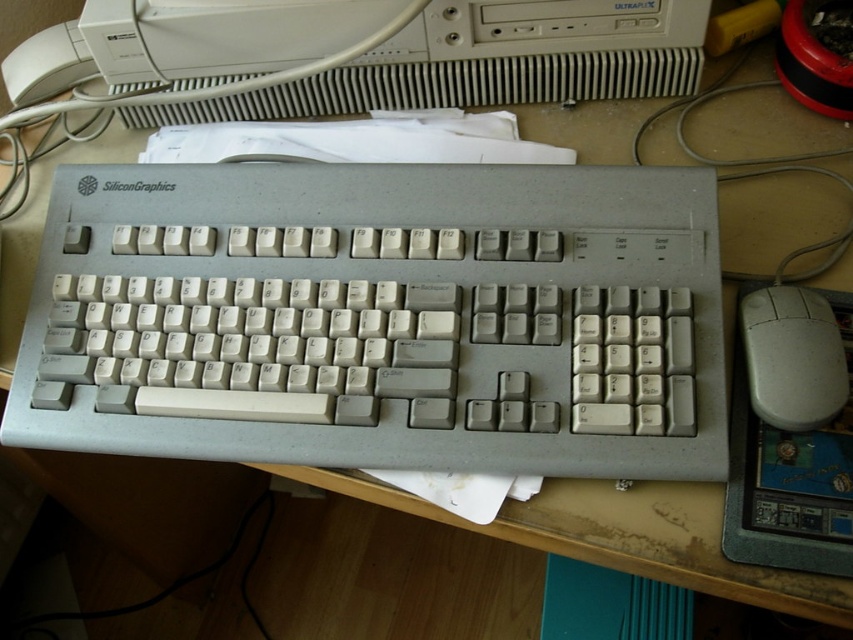
You are a photographer setting up a shot of the desk. You want to focus on the white plastic keyboard at center while keeping the beige computer tower in the background visible. Given the depth of field, will the beige computer tower be in focus if you focus on the keyboard?

The white plastic keyboard at center is 18.58 inches from the camera. Since the beige computer tower is further away, it may still be in focus depending on the aperture setting, but it might appear slightly out of focus compared to the keyboard.

You are organizing the desk and need to move the white plastic keyboard at center and the white plastic desktop computer at upper center. Based on their positions, which object is on the right side when viewed from the front?

The white plastic keyboard at center is on the right side of the white plastic desktop computer at upper center, so when viewed from the front, the white plastic keyboard at center is on the right.